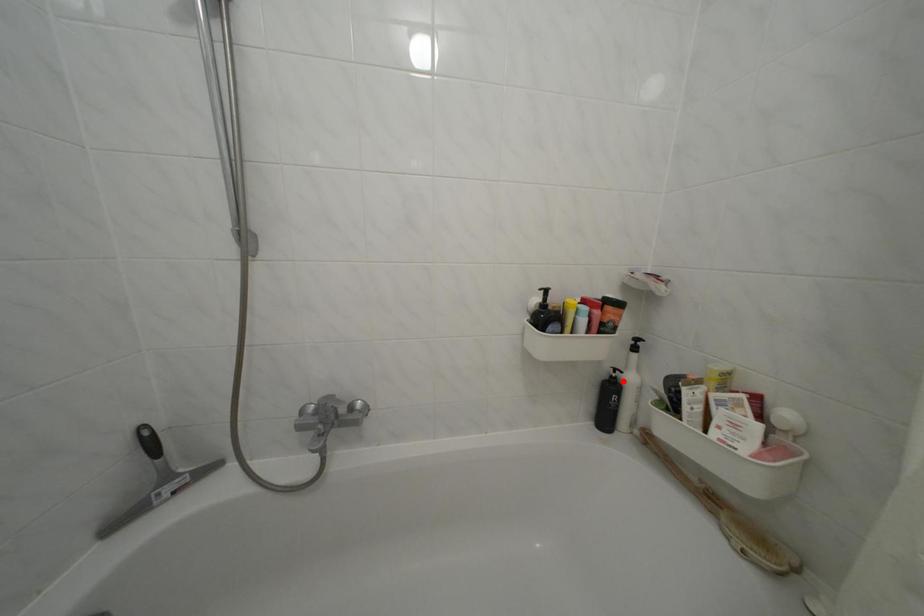
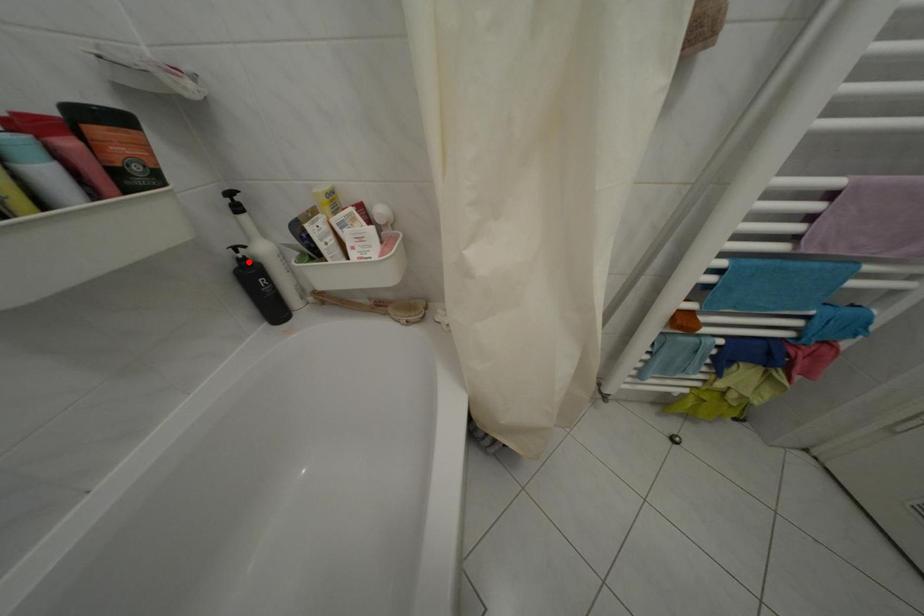
I am providing you with two images of the same scene from different viewpoints. A red point is marked on the first image and another point is marked on the second image. Is the red point in image1 aligned with the point shown in image2?

Yes